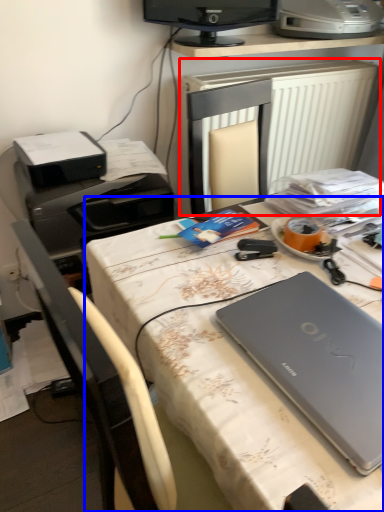
Question: Which point is further to the camera, radiator (highlighted by a red box) or desk (highlighted by a blue box)?

Choices:
 (A) radiator
 (B) desk

Answer: (A)